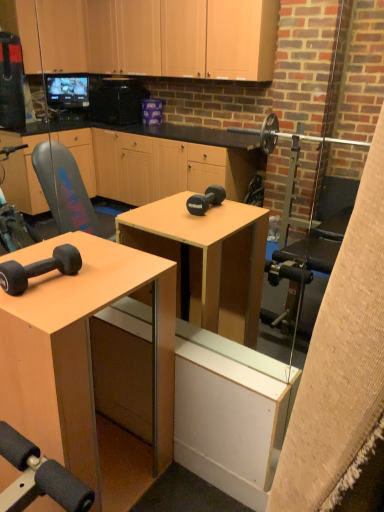
Question: Could you tell me if matte black dumbbell at lower left is facing matte wood desk at center?

Choices:
 (A) yes
 (B) no

Answer: (B)

Question: Is the depth of matte black dumbbell at lower left greater than that of matte wood desk at center?

Choices:
 (A) yes
 (B) no

Answer: (A)

Question: Would you say matte black dumbbell at lower left contains matte wood desk at center?

Choices:
 (A) yes
 (B) no

Answer: (B)

Question: Considering the relative sizes of matte black dumbbell at lower left and matte wood desk at center in the image provided, is matte black dumbbell at lower left wider than matte wood desk at center?

Choices:
 (A) yes
 (B) no

Answer: (B)

Question: Would you say matte black dumbbell at lower left is a long distance from matte wood desk at center?

Choices:
 (A) no
 (B) yes

Answer: (A)

Question: Is matte black dumbbell at lower left in contact with matte wood desk at center?

Choices:
 (A) yes
 (B) no

Answer: (B)

Question: Is matte wood desk at center at the right side of matte black dumbbell at lower left?

Choices:
 (A) no
 (B) yes

Answer: (A)

Question: Does matte wood desk at center have a lesser height compared to matte black dumbbell at lower left?

Choices:
 (A) no
 (B) yes

Answer: (A)

Question: Does matte wood desk at center have a lesser width compared to matte black dumbbell at lower left?

Choices:
 (A) no
 (B) yes

Answer: (A)

Question: Considering the relative positions of matte wood desk at center and matte black dumbbell at lower left in the image provided, is matte wood desk at center to the left of matte black dumbbell at lower left from the viewer's perspective?

Choices:
 (A) no
 (B) yes

Answer: (B)

Question: Is matte wood desk at center oriented away from matte black dumbbell at lower left?

Choices:
 (A) no
 (B) yes

Answer: (A)

Question: Is matte wood desk at center positioned behind matte black dumbbell at lower left?

Choices:
 (A) yes
 (B) no

Answer: (B)

Question: Choose the correct answer: Is matte black dumbbell at lower left inside matte wood desk at center or outside it?

Choices:
 (A) inside
 (B) outside

Answer: (B)